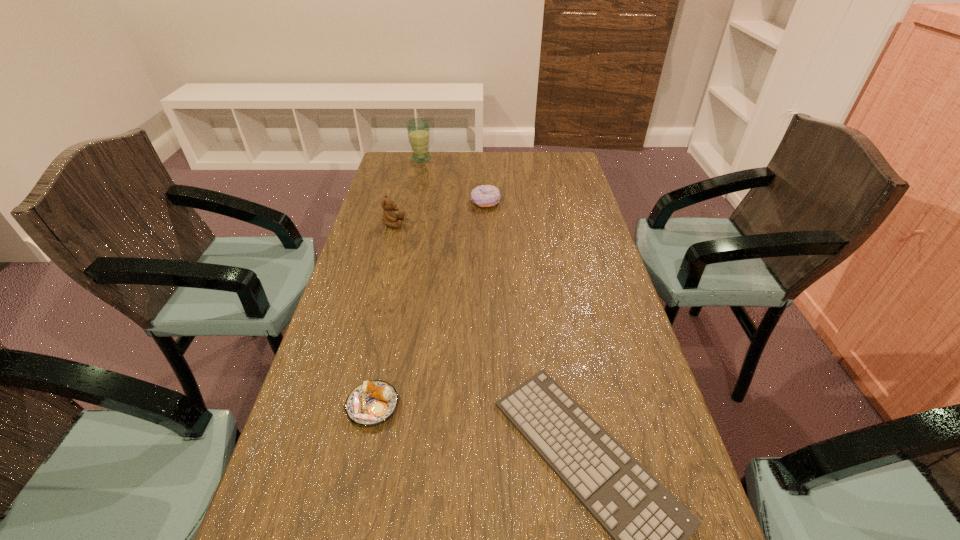
Image resolution: width=960 pixels, height=540 pixels. What are the coordinates of `vacant area between the tallest object and the fourth tallest object` in the screenshot? It's located at (397, 282).

This screenshot has height=540, width=960. Find the location of `free space between the second tallest object and the doughnut`. free space between the second tallest object and the doughnut is located at coordinates (440, 213).

The height and width of the screenshot is (540, 960). I want to click on free space between the teddy bear and the farthest object, so point(407,191).

I want to click on free space between the fourth tallest object and the farthest object, so tap(397, 282).

Find the location of a particular element. empty space between the fourth tallest object and the third nearest object is located at coordinates (383, 314).

The height and width of the screenshot is (540, 960). In order to click on free space between the second tallest object and the farthest object in this screenshot , I will do `click(407, 191)`.

You are a GUI agent. You are given a task and a screenshot of the screen. Output one action in this format:
    pyautogui.click(x=<x>, y=<y>)
    Task: Click on the free space between the fourth nearest object and the tallest object
    The height and width of the screenshot is (540, 960).
    Given the screenshot: What is the action you would take?
    pyautogui.click(x=453, y=180)

Find the location of `free space between the third shortest object and the third nearest object`. free space between the third shortest object and the third nearest object is located at coordinates (440, 213).

Identify the location of free space that is in between the second shortest object and the doughnut. The height and width of the screenshot is (540, 960). (429, 304).

Choose which object is the third nearest neighbor to the second farthest object. Please provide its 2D coordinates. Your answer should be formatted as a tuple, i.e. [(x, y)], where the tuple contains the x and y coordinates of a point satisfying the conditions above.

[(650, 527)]